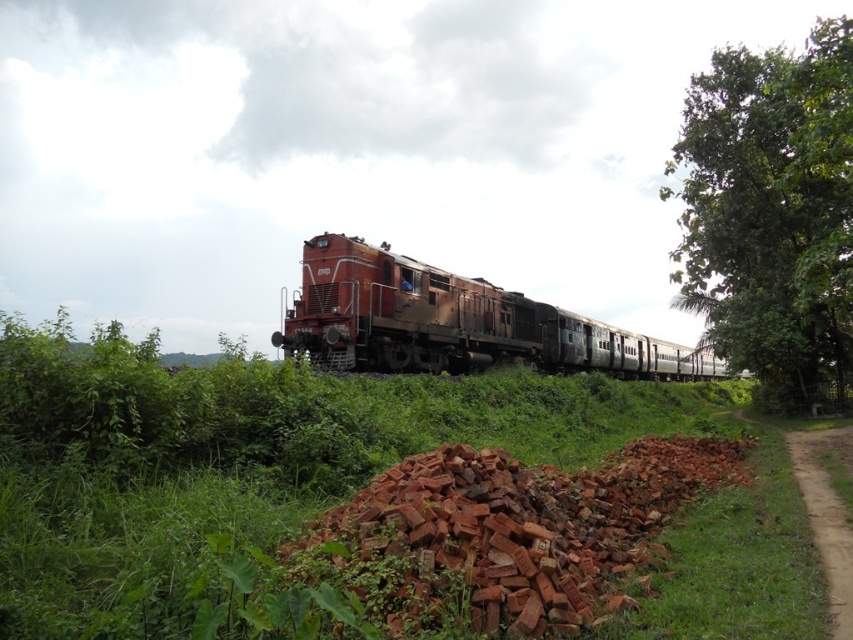
Question: Estimate the real-world distances between objects in this image. Which object is farther from the rusty metal train at center?

Choices:
 (A) brick rubble at lower center
 (B) green leafy tree at upper right

Answer: (A)

Question: Is brick rubble at lower center wider than brown dirt track at lower right?

Choices:
 (A) yes
 (B) no

Answer: (A)

Question: Does green leafy tree at upper right have a smaller size compared to rusty metal train at center?

Choices:
 (A) yes
 (B) no

Answer: (B)

Question: Considering the real-world distances, which object is farthest from the green leafy tree at upper right?

Choices:
 (A) brick rubble at lower center
 (B) rusty metal train at center

Answer: (A)

Question: Which is nearer to the brick rubble at lower center?

Choices:
 (A) green leafy tree at upper right
 (B) brown dirt track at lower right
 (C) rusty metal train at center

Answer: (B)

Question: Does green leafy tree at upper right have a lesser width compared to brown dirt track at lower right?

Choices:
 (A) no
 (B) yes

Answer: (A)